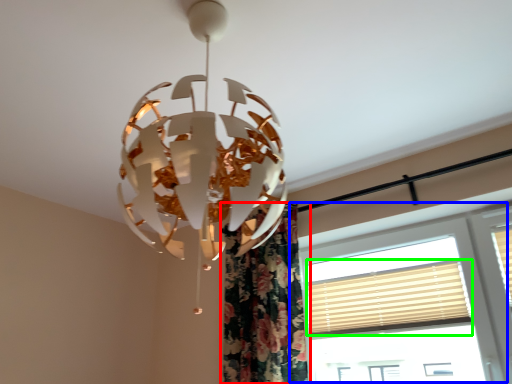
Question: Considering the real-world distances, which object is farthest from curtain (highlighted by a red box)? window (highlighted by a blue box) or blind (highlighted by a green box)?

Choices:
 (A) window
 (B) blind

Answer: (A)